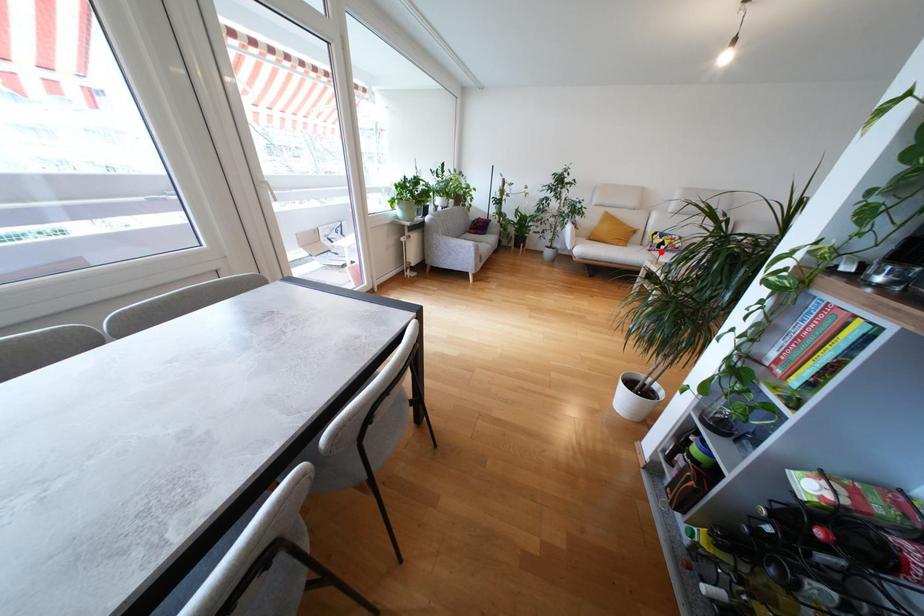
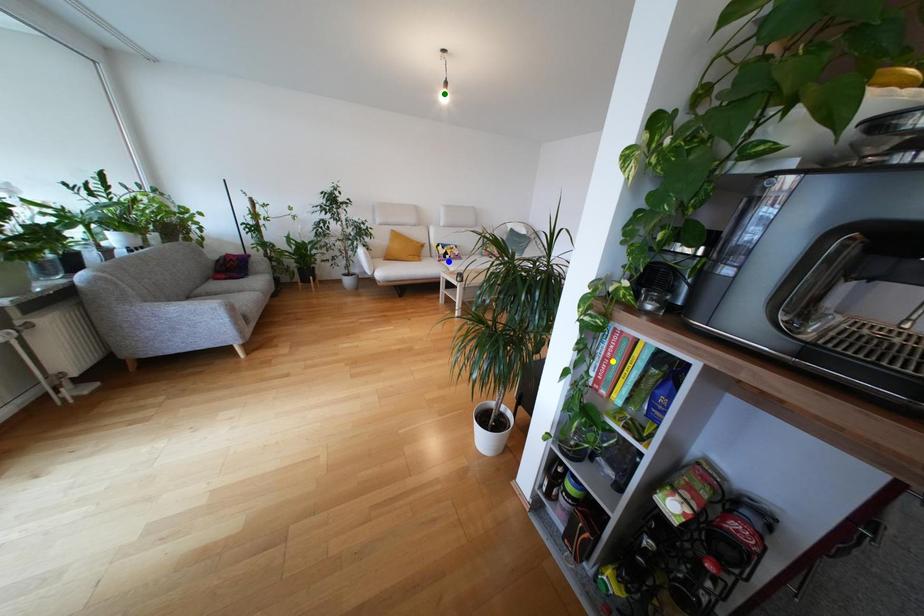
Question: I am providing you with two images of the same scene from different viewpoints. A red point is marked on the first image. You are given multiple points on the second image. Which spot in image 2 lines up with the point in image 1?

Choices:
 (A) yellow point
 (B) blue point
 (C) green point

Answer: (B)